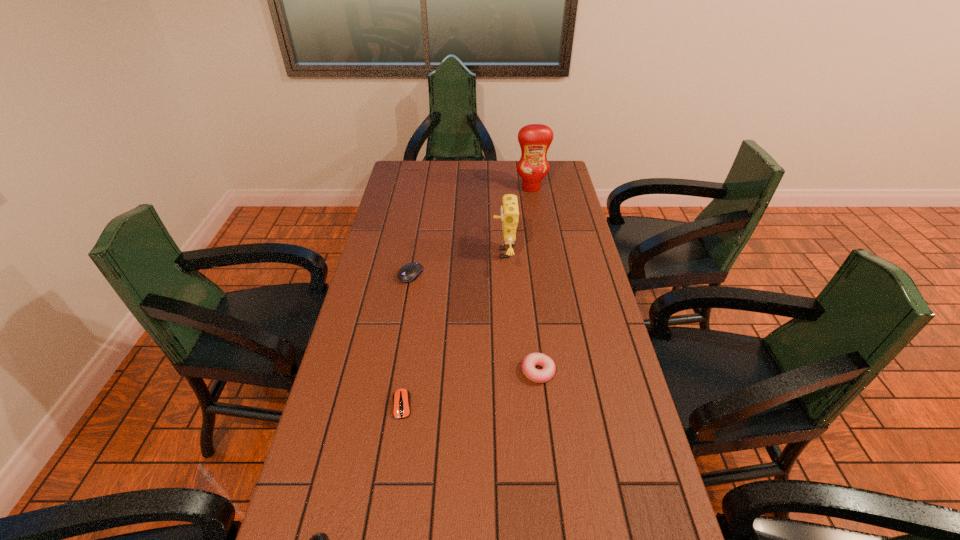
Locate an element on the screen. Image resolution: width=960 pixels, height=540 pixels. the farthest object is located at coordinates (534, 139).

Locate an element on the screen. condiment is located at coordinates (534, 139).

The height and width of the screenshot is (540, 960). Identify the location of the second tallest object. (509, 210).

This screenshot has height=540, width=960. Find the location of `the tallest computer mouse`. the tallest computer mouse is located at coordinates (409, 272).

Locate an element on the screen. Image resolution: width=960 pixels, height=540 pixels. doughnut is located at coordinates (543, 375).

Find the location of a particular element. Image resolution: width=960 pixels, height=540 pixels. the fifth farthest object is located at coordinates pos(401,398).

Where is `vacant area situated 0.090m on the label side of the tallest object`? The image size is (960, 540). vacant area situated 0.090m on the label side of the tallest object is located at coordinates (534, 205).

At what (x,y) coordinates should I click in order to perform the action: click on free space located on the face of the sponge. Please return your answer as a coordinate pair (x, y). Looking at the image, I should click on (440, 253).

The image size is (960, 540). Identify the location of free spot located on the face of the sponge. (400, 253).

Identify the location of free space located on the face of the sponge. This screenshot has width=960, height=540. coord(403,253).